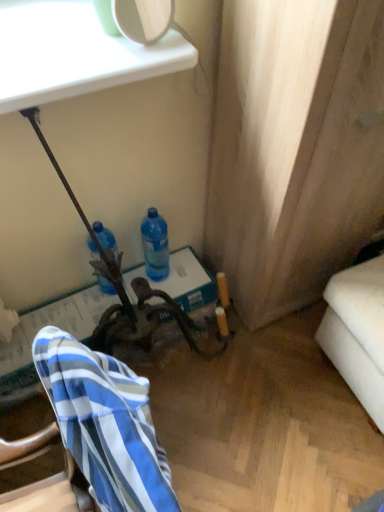
What do you see at coordinates (106, 238) in the screenshot? The height and width of the screenshot is (512, 384). I see `blue translucent bottle at center, which is the second bottle from right to left` at bounding box center [106, 238].

Measure the distance between blue translucent bottle at center, arranged as the 1th bottle when viewed from the left, and camera.

blue translucent bottle at center, arranged as the 1th bottle when viewed from the left, is 4.18 feet away from camera.

How much space does blue translucent bottle at center, placed as the first bottle when sorted from right to left, occupy horizontally?

3.66 inches.

Locate an element on the screen. blue striped fabric at lower left is located at coordinates click(x=93, y=435).

Considering the sizes of objects blue translucent bottle at center, which is the second bottle from right to left, and blue striped fabric at lower left in the image provided, who is thinner, blue translucent bottle at center, which is the second bottle from right to left, or blue striped fabric at lower left?

Thinner between the two is blue translucent bottle at center, which is the second bottle from right to left.

Considering the relative positions of blue translucent bottle at center, which is the second bottle from right to left, and blue striped fabric at lower left in the image provided, is blue translucent bottle at center, which is the second bottle from right to left, to the left of blue striped fabric at lower left from the viewer's perspective?

Correct, you'll find blue translucent bottle at center, which is the second bottle from right to left, to the left of blue striped fabric at lower left.

Based on their sizes in the image, would you say blue translucent bottle at center, arranged as the 1th bottle when viewed from the left, is bigger or smaller than blue striped fabric at lower left?

blue translucent bottle at center, arranged as the 1th bottle when viewed from the left, is smaller than blue striped fabric at lower left.

Is blue translucent bottle at center, which is the second bottle from right to left, next to blue striped fabric at lower left?

No, blue translucent bottle at center, which is the second bottle from right to left, is not next to blue striped fabric at lower left.

Does blue translucent bottle at center, which is the second bottle from right to left, have a lesser width compared to blue translucent bottle at center, placed as the first bottle when sorted from right to left?

In fact, blue translucent bottle at center, which is the second bottle from right to left, might be wider than blue translucent bottle at center, placed as the first bottle when sorted from right to left.

Which point is more distant from viewer, (110, 233) or (165, 232)?

The point (165, 232) is behind.

How many degrees apart are the facing directions of blue translucent bottle at center, arranged as the 1th bottle when viewed from the left, and blue translucent bottle at center, which ranks as the 2th bottle in left-to-right order?

The angle between the facing direction of blue translucent bottle at center, arranged as the 1th bottle when viewed from the left, and the facing direction of blue translucent bottle at center, which ranks as the 2th bottle in left-to-right order, is 0.158 degrees.

From the image's perspective, relative to blue translucent bottle at center, which ranks as the 2th bottle in left-to-right order, is blue translucent bottle at center, arranged as the 1th bottle when viewed from the left, above or below?

blue translucent bottle at center, arranged as the 1th bottle when viewed from the left, is below blue translucent bottle at center, which ranks as the 2th bottle in left-to-right order.

Could you tell me if blue translucent bottle at center, placed as the first bottle when sorted from right to left, is facing blue striped fabric at lower left?

No, blue translucent bottle at center, placed as the first bottle when sorted from right to left, is not facing towards blue striped fabric at lower left.

From a real-world perspective, is blue translucent bottle at center, placed as the first bottle when sorted from right to left, beneath blue striped fabric at lower left?

Correct, in the physical world, blue translucent bottle at center, placed as the first bottle when sorted from right to left, is lower than blue striped fabric at lower left.

Are blue translucent bottle at center, which ranks as the 2th bottle in left-to-right order, and blue striped fabric at lower left far apart?

No.

Is blue translucent bottle at center, placed as the first bottle when sorted from right to left, at the right side of blue striped fabric at lower left?

Yes.

Where is `chair on the right of the blue translucent bottle at center, which is the second bottle from right to left`? chair on the right of the blue translucent bottle at center, which is the second bottle from right to left is located at coordinates (93, 435).

From the image's perspective, relative to blue translucent bottle at center, arranged as the 1th bottle when viewed from the left, is blue striped fabric at lower left above or below?

Based on their image positions, blue striped fabric at lower left is located beneath blue translucent bottle at center, arranged as the 1th bottle when viewed from the left.

Which of these two, blue translucent bottle at center, which ranks as the 2th bottle in left-to-right order, or blue translucent bottle at center, which is the second bottle from right to left, is bigger?

blue translucent bottle at center, which is the second bottle from right to left.

How much distance is there between blue translucent bottle at center, which ranks as the 2th bottle in left-to-right order, and blue translucent bottle at center, arranged as the 1th bottle when viewed from the left?

blue translucent bottle at center, which ranks as the 2th bottle in left-to-right order, and blue translucent bottle at center, arranged as the 1th bottle when viewed from the left, are 15.40 centimeters apart from each other.

Is point (154, 279) farther from camera compared to point (114, 239)?

Yes, it is behind point (114, 239).

From a real-world perspective, relative to blue translucent bottle at center, which is the second bottle from right to left, is blue translucent bottle at center, placed as the first bottle when sorted from right to left, vertically above or below?

blue translucent bottle at center, placed as the first bottle when sorted from right to left, is above blue translucent bottle at center, which is the second bottle from right to left.

From the image's perspective, which one is positioned lower, blue striped fabric at lower left or blue translucent bottle at center, placed as the first bottle when sorted from right to left?

From the image's view, blue striped fabric at lower left is below.

This screenshot has height=512, width=384. Identify the location of chair in front of the blue translucent bottle at center, placed as the first bottle when sorted from right to left. (93, 435).

Is point (40, 348) positioned behind point (147, 259)?

No, it is not.

Identify the location of chair in front of the blue translucent bottle at center, which is the second bottle from right to left. (93, 435).

At what (x,y) coordinates should I click in order to perform the action: click on bottle that is above the blue translucent bottle at center, which is the second bottle from right to left (from a real-world perspective). Please return your answer as a coordinate pair (x, y). Looking at the image, I should click on (155, 245).

Estimate the real-world distances between objects in this image. Which object is closer to blue translucent bottle at center, which is the second bottle from right to left, blue translucent bottle at center, placed as the first bottle when sorted from right to left, or blue striped fabric at lower left?

blue translucent bottle at center, placed as the first bottle when sorted from right to left.

Estimate the real-world distances between objects in this image. Which object is further from blue translucent bottle at center, which ranks as the 2th bottle in left-to-right order, blue translucent bottle at center, arranged as the 1th bottle when viewed from the left, or blue striped fabric at lower left?

The object further to blue translucent bottle at center, which ranks as the 2th bottle in left-to-right order, is blue striped fabric at lower left.

Looking at the image, which one is located further to blue translucent bottle at center, arranged as the 1th bottle when viewed from the left, blue striped fabric at lower left or blue translucent bottle at center, placed as the first bottle when sorted from right to left?

Among the two, blue striped fabric at lower left is located further to blue translucent bottle at center, arranged as the 1th bottle when viewed from the left.

Considering their positions, is blue translucent bottle at center, which is the second bottle from right to left, positioned closer to blue striped fabric at lower left than blue translucent bottle at center, placed as the first bottle when sorted from right to left?

blue translucent bottle at center, which is the second bottle from right to left, lies closer to blue striped fabric at lower left than the other object.

Estimate the real-world distances between objects in this image. Which object is further from blue translucent bottle at center, which ranks as the 2th bottle in left-to-right order, blue striped fabric at lower left or blue translucent bottle at center, which is the second bottle from right to left?

blue striped fabric at lower left.

When comparing their distances from blue striped fabric at lower left, does blue translucent bottle at center, which ranks as the 2th bottle in left-to-right order, or blue translucent bottle at center, which is the second bottle from right to left, seem further?

blue translucent bottle at center, which ranks as the 2th bottle in left-to-right order, is positioned further to the anchor blue striped fabric at lower left.

Locate an element on the screen. bottle positioned between blue striped fabric at lower left and blue translucent bottle at center, which ranks as the 2th bottle in left-to-right order, from near to far is located at coordinates (106, 238).